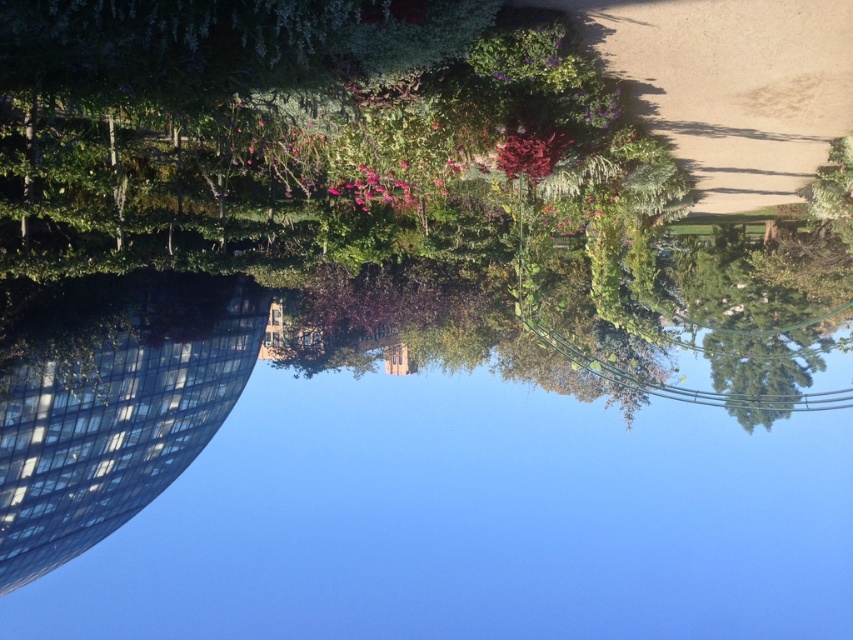
Question: Which point is closer to the camera taking this photo?

Choices:
 (A) (114, 138)
 (B) (709, 289)

Answer: (A)

Question: Is transparent glass water at center above green leafy tree at center?

Choices:
 (A) yes
 (B) no

Answer: (B)

Question: Does transparent glass water at center have a greater width compared to green leafy tree at center?

Choices:
 (A) yes
 (B) no

Answer: (A)

Question: Does transparent glass water at center appear over green leafy tree at center?

Choices:
 (A) yes
 (B) no

Answer: (B)

Question: Which of the following is the farthest from the observer?

Choices:
 (A) (47, 17)
 (B) (224, 566)

Answer: (B)